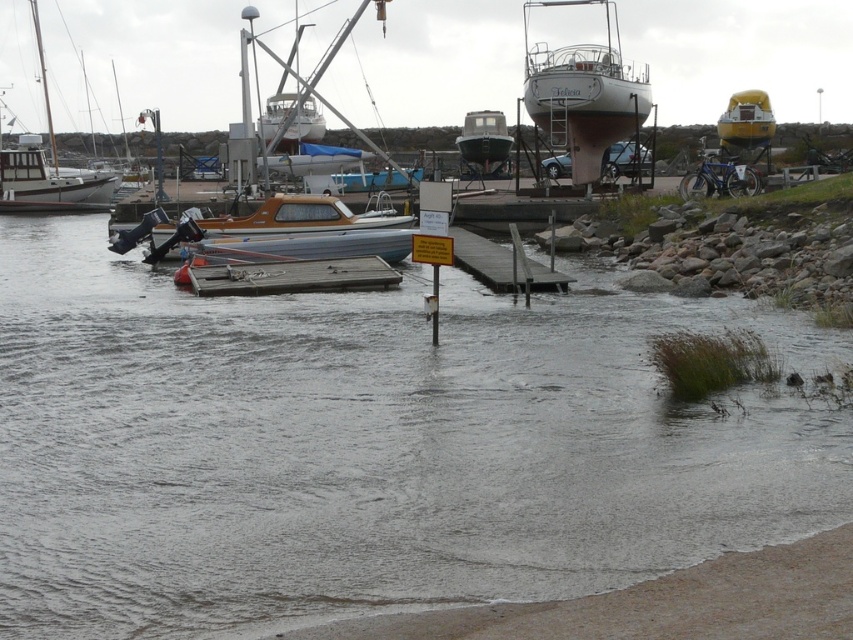
You are a dock worker who needs to move a 35 meter long cargo container from the white glossy boat at center to the brushed metal boat at left. Can you fit the cargo container between them without any part of it extending beyond the space?

The distance between the white glossy boat at center and the brushed metal boat at left is 36.17 meters, which is slightly longer than the 35 meter cargo container. Therefore, the cargo container can be placed between them without extending beyond the available space.

Looking at this image, you are a dock worker who needs to move a new cargo container that is 10 meters long. You want to place it near the white glossy boat at center and the brushed metal boat at left. Which boat should you place it closer to if you want the container to be as far as possible from the larger boat?

The white glossy boat at center is smaller than the brushed metal boat at left, so the larger boat is the brushed metal boat at left. To place the container as far as possible from the larger boat, you should place it closer to the white glossy boat at center.

You are a dock worker who needs to stack some equipment on the white glossy boat at center and the yellow matte boat at upper right. Which boat can accommodate taller equipment?

The white glossy boat at center can accommodate taller equipment since it has a greater height compared to the yellow matte boat at upper right.